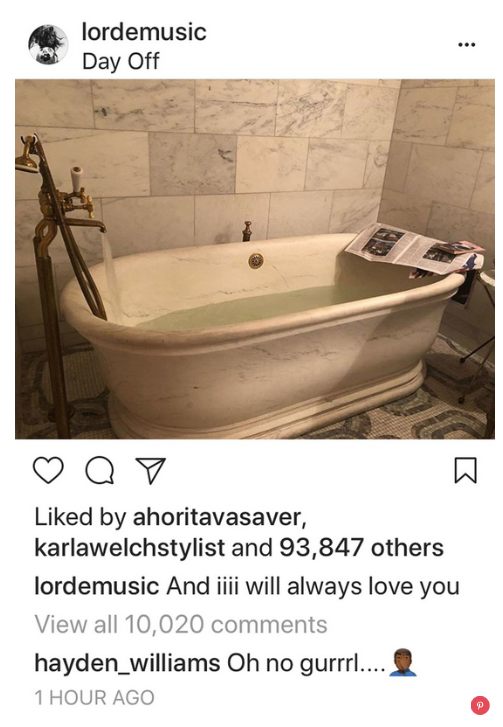
Locate an element on the screen. Image resolution: width=503 pixels, height=727 pixels. newspaper is located at coordinates (414, 249).